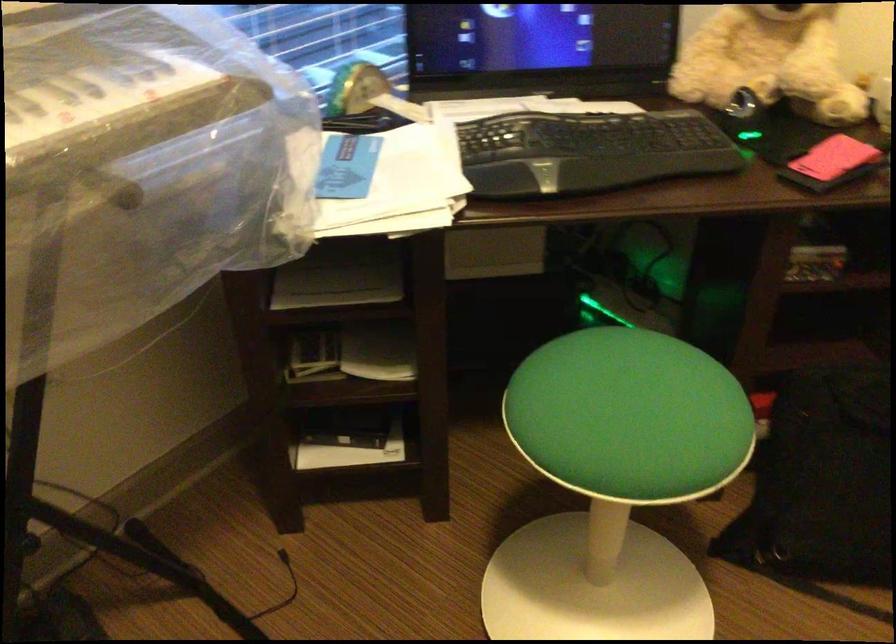
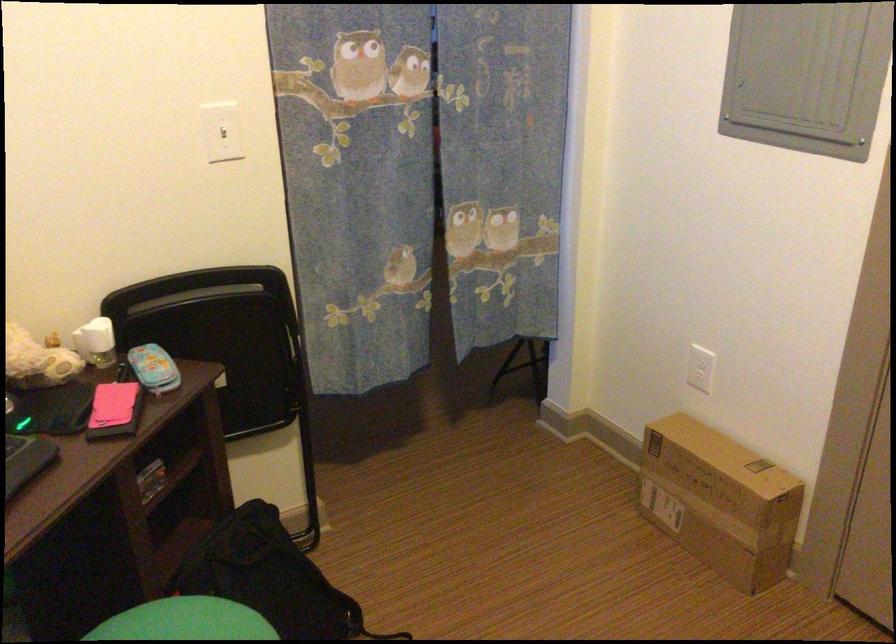
The point at [691,377] is marked in the first image. Where is the corresponding point in the second image?

(185, 621)